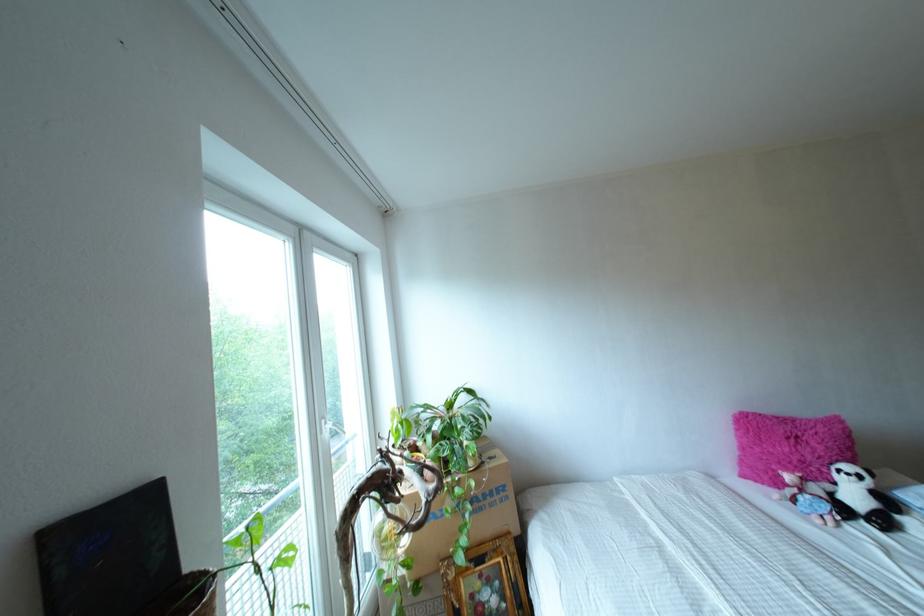
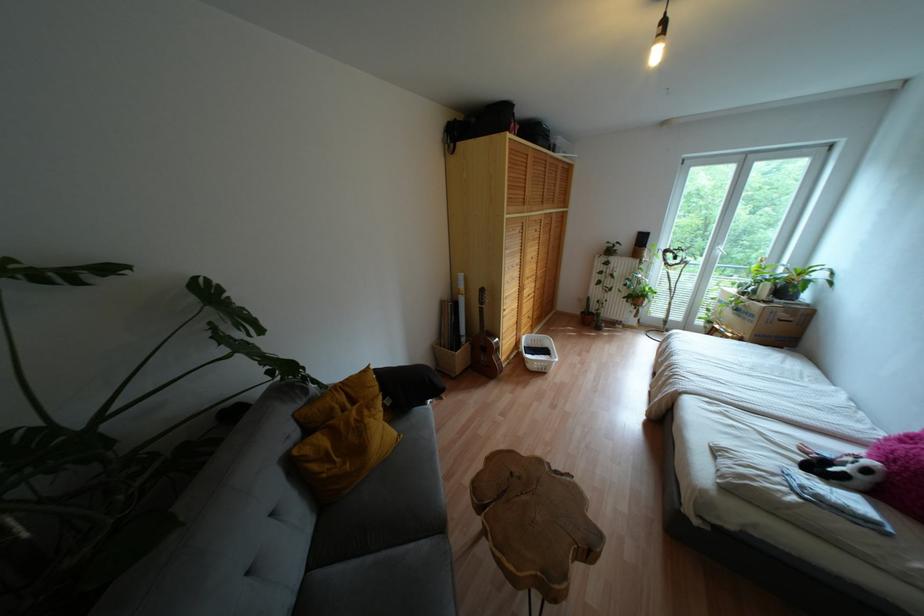
Find the pixel in the second image that matches the point at 480,508 in the first image.

(737, 315)